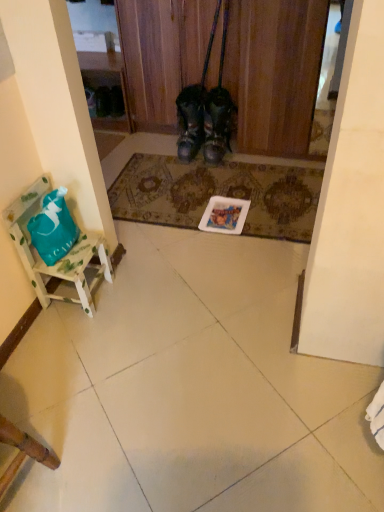
Identify the location of vacant point above patterned carpet at center (from a real-world perspective). (206, 188).